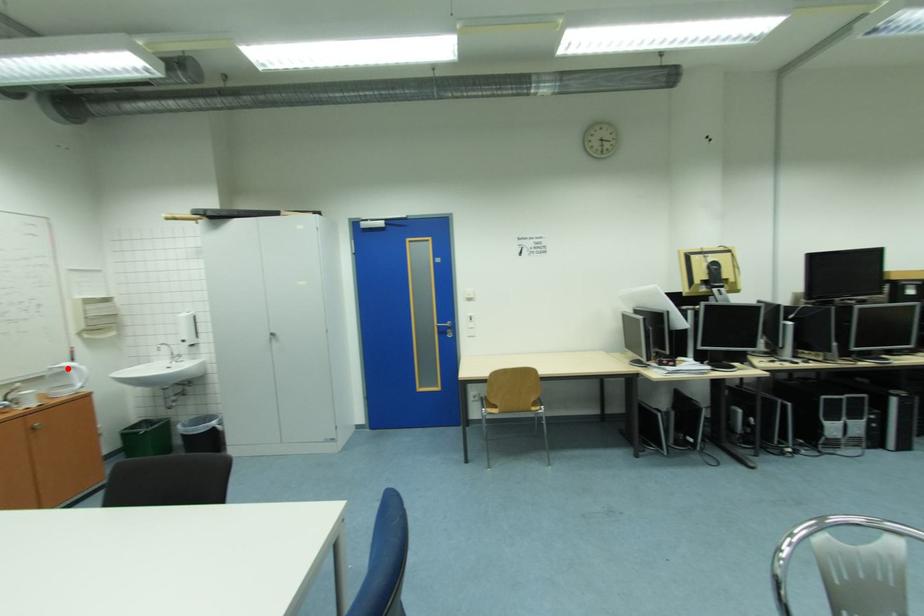
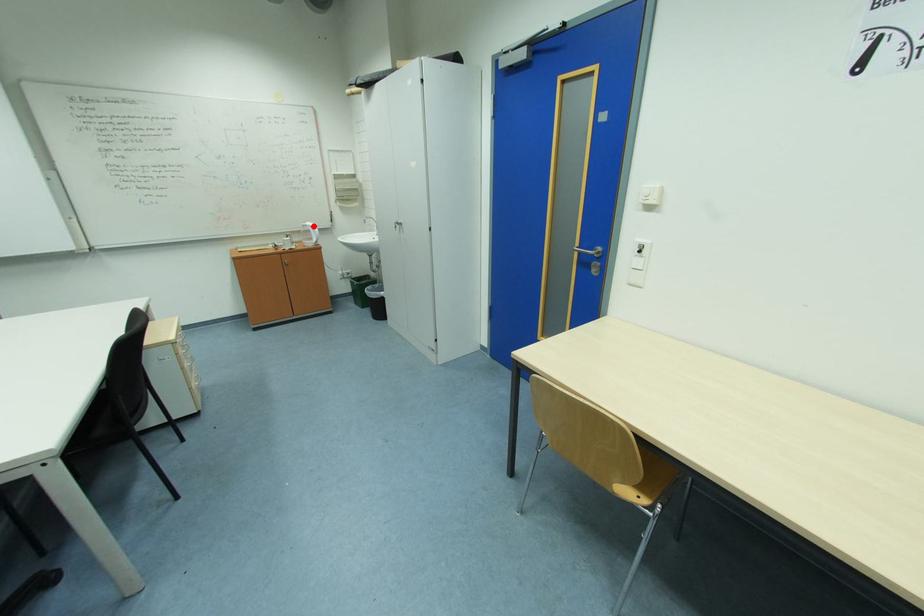
I am providing you with two images of the same scene from different viewpoints. A red point is marked on the first image and another point is marked on the second image. Is the red point in image1 aligned with the point shown in image2?

Yes